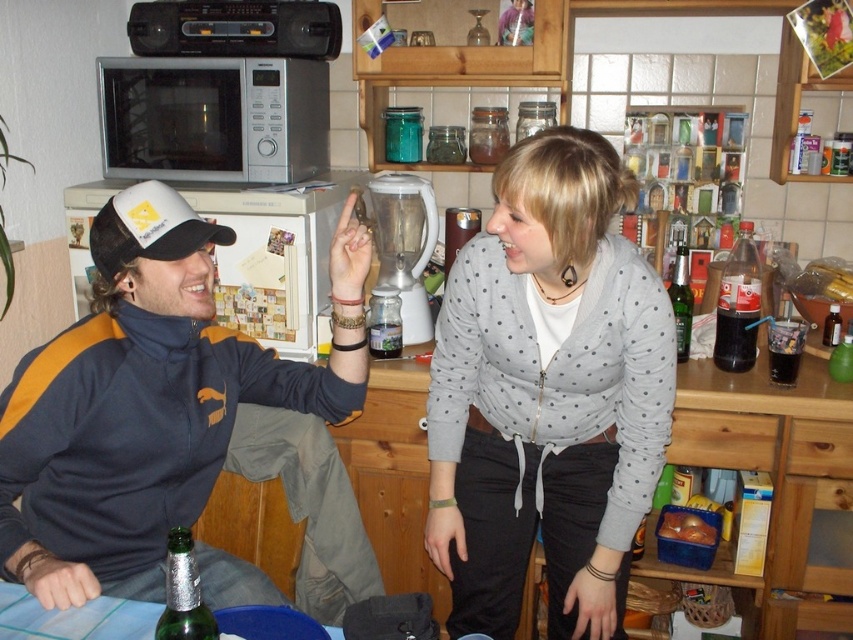
You are at a kitchen table and see a translucent plastic cup at right and a transparent plastic bottle at right. Which one is smaller?

The translucent plastic cup at right is smaller than the transparent plastic bottle at right.

You are a delivery person who needs to place a small package on the nearest surface to the matte gray sweater at center. The package is 0.3 meters wide. Can you fit it there?

The matte gray sweater at center is 1.12 meters from camera. Since the package is 0.3 meters wide, it can be placed near the sweater as the distance allows sufficient space.

You are organizing a kitchen storage space and need to decide which item to place on a shelf that can only hold items smaller than the other. You have the matte gray sweater at center and the white plastic blender at center. Which item should you place on the shelf?

The white plastic blender at center should be placed on the shelf since it is smaller than the matte gray sweater at center, which cannot fit due to its larger size.